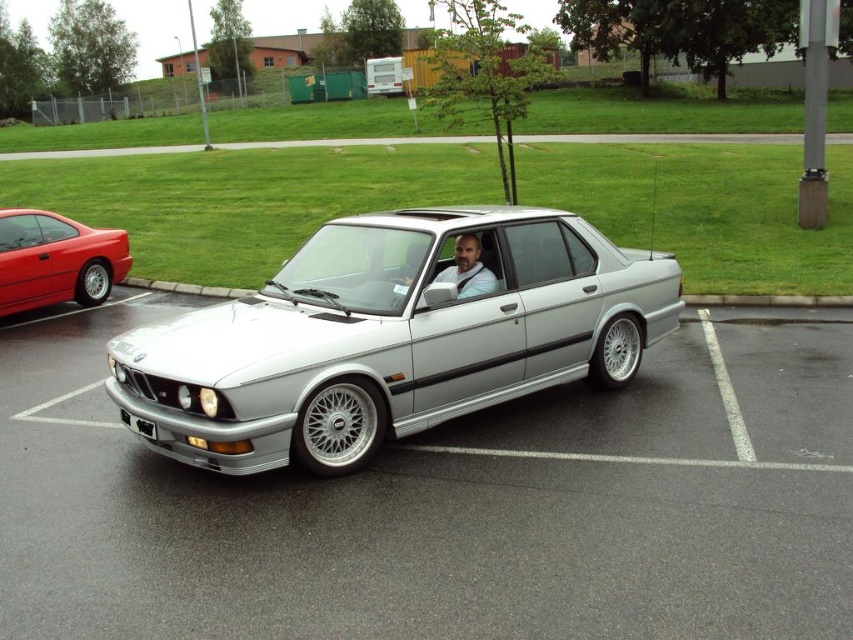
The width and height of the screenshot is (853, 640). Describe the element at coordinates (392, 337) in the screenshot. I see `satin silver car at center` at that location.

Is satin silver car at center bigger than shiny red car at left?

Yes.

Is point (445, 259) positioned before point (100, 228)?

Yes, it is.

Image resolution: width=853 pixels, height=640 pixels. Find the location of `satin silver car at center`. satin silver car at center is located at coordinates (392, 337).

Can you confirm if satin silver car at center is thinner than black plastic license plate at front?

Incorrect, satin silver car at center's width is not less than black plastic license plate at front's.

Does satin silver car at center appear over black plastic license plate at front?

Yes, satin silver car at center is above black plastic license plate at front.

Is point (202, 440) farther from camera compared to point (131, 426)?

No, it is in front of (131, 426).

I want to click on satin silver car at center, so (x=392, y=337).

Does satin silver car at center have a greater height compared to bearded man in shirt at center?

Correct, satin silver car at center is much taller as bearded man in shirt at center.

This screenshot has width=853, height=640. I want to click on satin silver car at center, so click(x=392, y=337).

Who is more distant from viewer, [386,244] or [468,278]?

The point [468,278] is more distant.

You are a GUI agent. You are given a task and a screenshot of the screen. Output one action in this format:
    pyautogui.click(x=<x>, y=<y>)
    Task: Click on the satin silver car at center
    This screenshot has width=853, height=640.
    Given the screenshot: What is the action you would take?
    pyautogui.click(x=392, y=337)